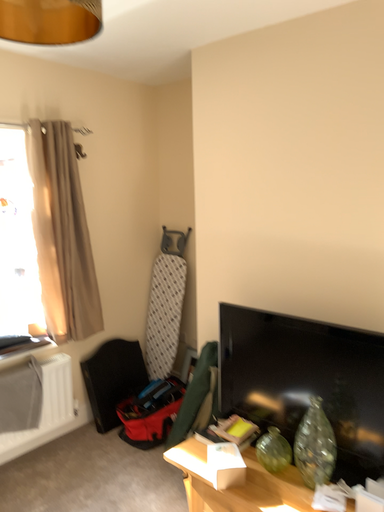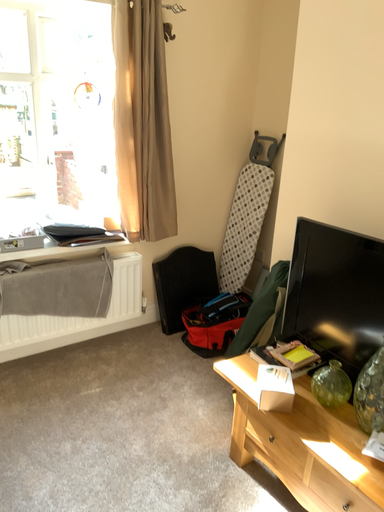
Question: How did the camera likely rotate when shooting the video?

Choices:
 (A) rotated right
 (B) rotated left

Answer: (B)